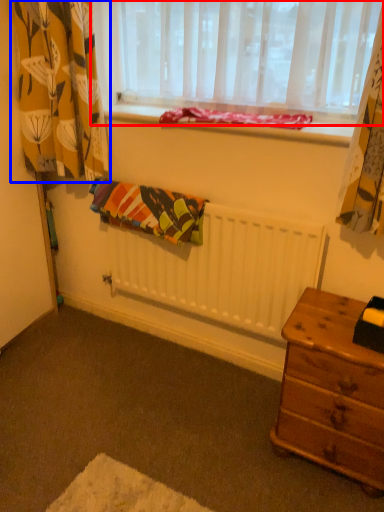
Question: Which point is further to the camera, window (highlighted by a red box) or curtain (highlighted by a blue box)?

Choices:
 (A) window
 (B) curtain

Answer: (B)